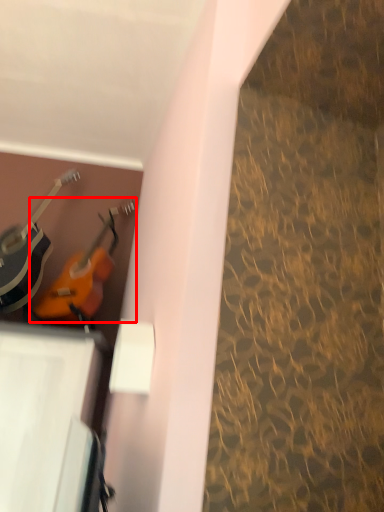
Question: From the image's perspective, what is the correct spatial positioning of guitar (annotated by the red box) in reference to guitar?

Choices:
 (A) below
 (B) above

Answer: (A)